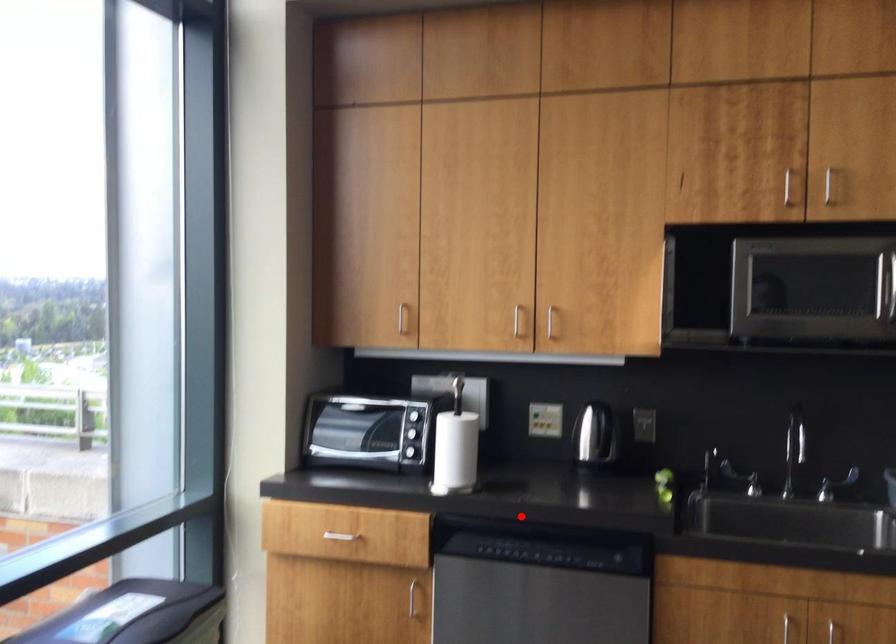
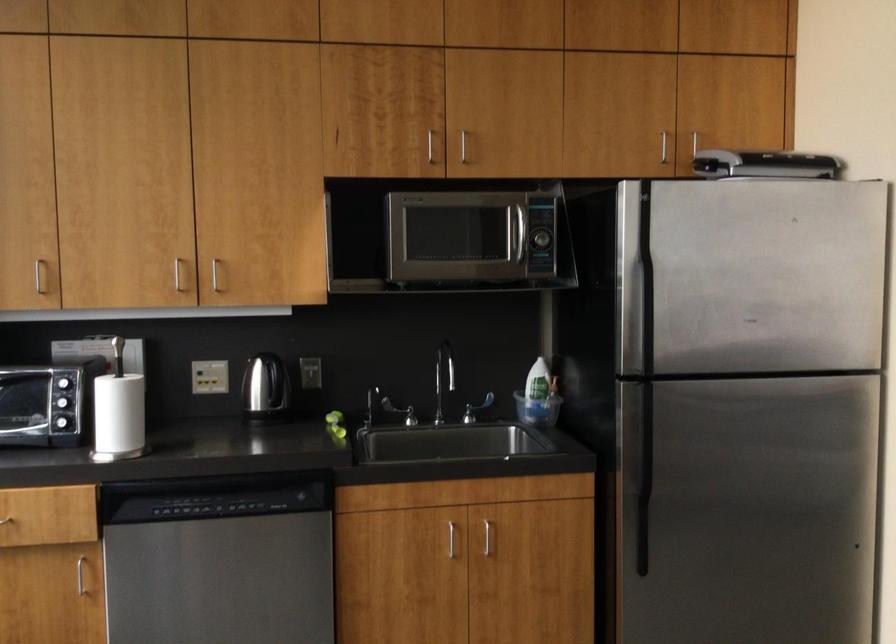
Locate, in the second image, the point that corresponds to the highlighted location in the first image.

(208, 471)